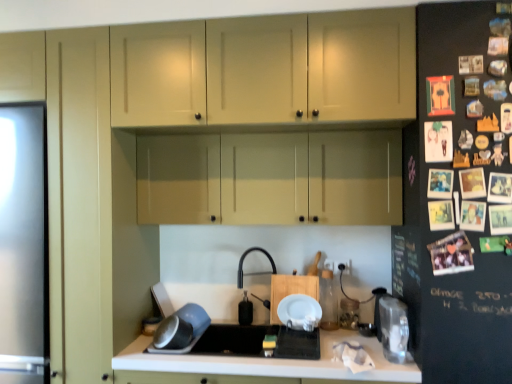
Identify the location of free space on the front side of translucent plastic container at center, arranged as the second appliance when viewed from the left. (357, 337).